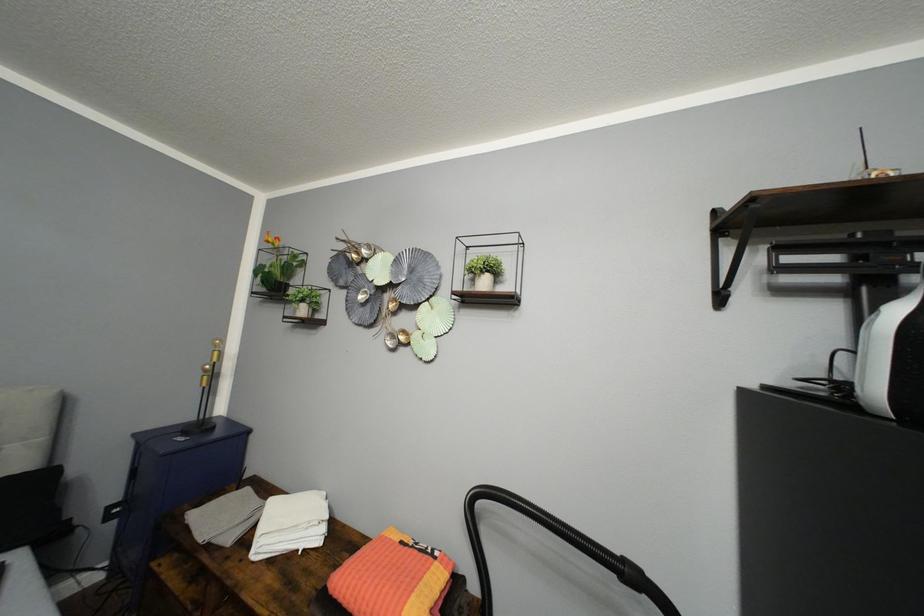
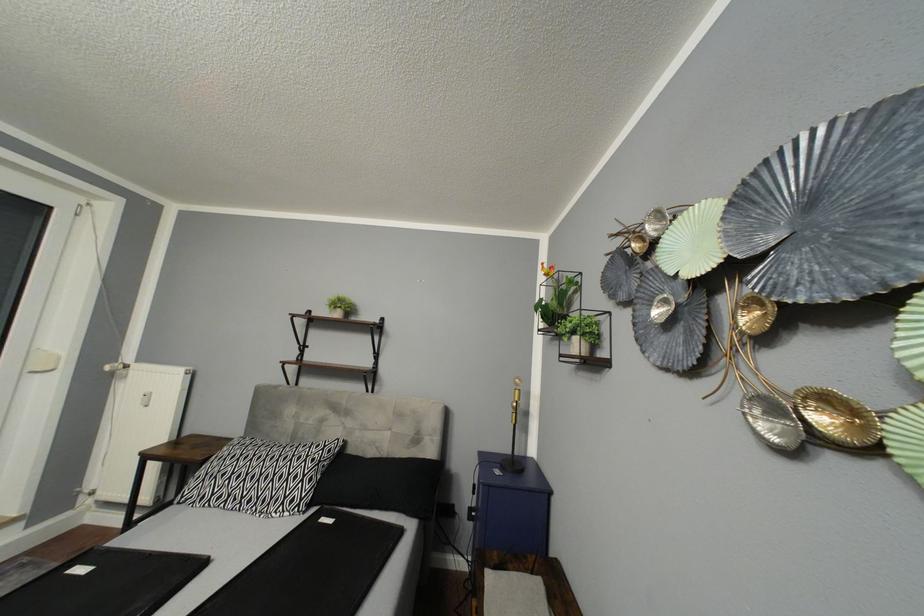
Question: How did the camera likely rotate?

Choices:
 (A) Left
 (B) Right
 (C) Up
 (D) Down

Answer: (A)